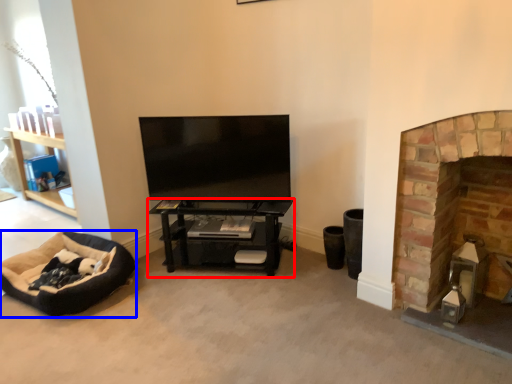
Question: Among these objects, which one is farthest to the camera, shelf (highlighted by a red box) or dog bed (highlighted by a blue box)?

Choices:
 (A) shelf
 (B) dog bed

Answer: (A)